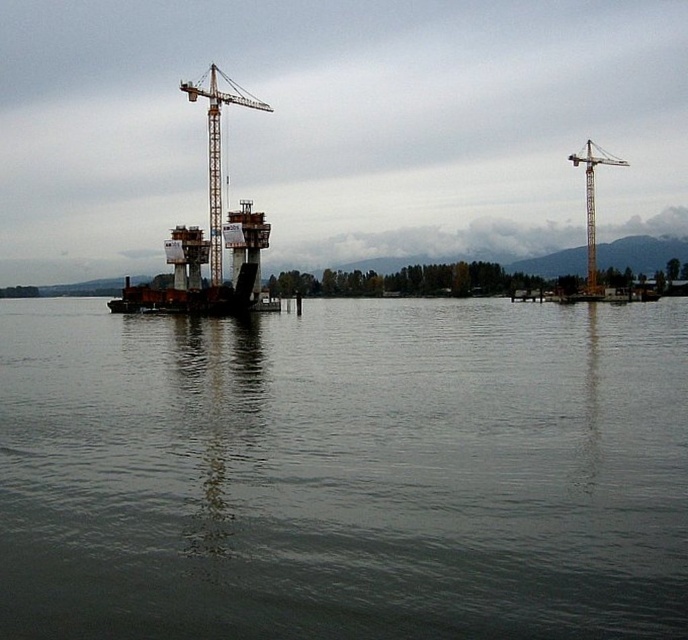
Question: Is gray matte water at center further to the viewer compared to yellow metallic crane at right?

Choices:
 (A) yes
 (B) no

Answer: (B)

Question: Which point is closer to the camera taking this photo?

Choices:
 (A) (585, 200)
 (B) (41, 552)

Answer: (B)

Question: Can you confirm if gray matte water at center is wider than yellow metallic crane at center?

Choices:
 (A) yes
 (B) no

Answer: (A)

Question: Which of the following is the farthest from the observer?

Choices:
 (A) (213, 205)
 (B) (601, 154)

Answer: (B)

Question: Considering the relative positions of gray matte water at center and orange metallic bridge at center in the image provided, where is gray matte water at center located with respect to orange metallic bridge at center?

Choices:
 (A) right
 (B) left

Answer: (A)

Question: Which object is the farthest from the gray matte water at center?

Choices:
 (A) orange metallic bridge at center
 (B) yellow metallic crane at right
 (C) yellow metallic crane at center

Answer: (B)